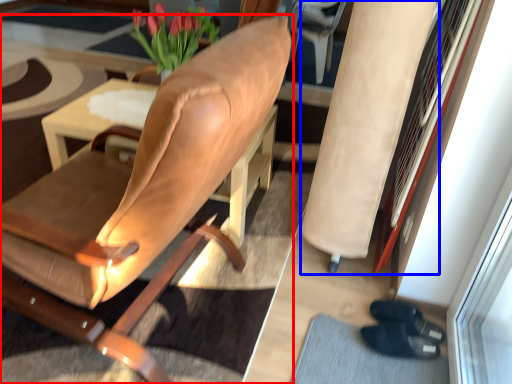
Question: Which of the following is the closest to the observer, chair (highlighted by a red box) or beige (highlighted by a blue box)?

Choices:
 (A) chair
 (B) beige

Answer: (A)